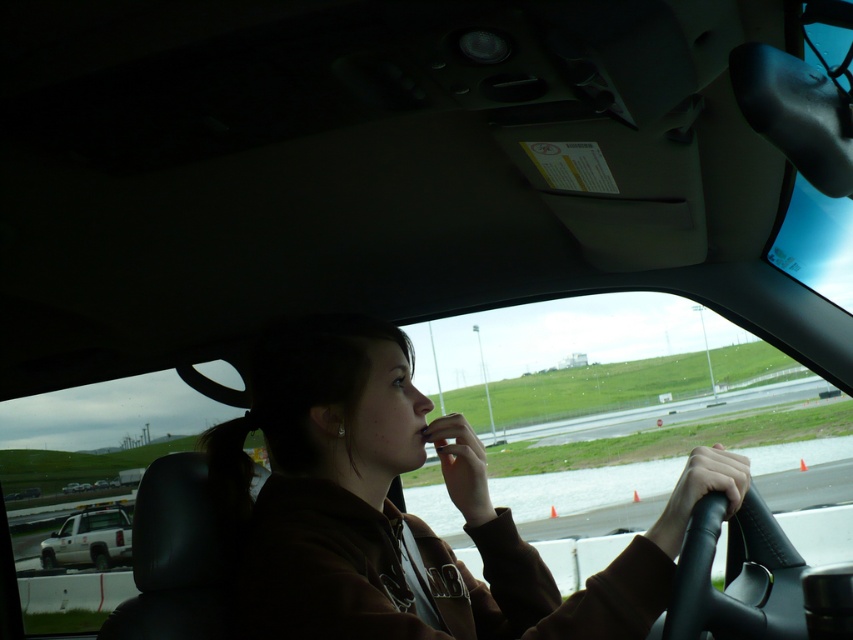
Question: Is brown cotton jacket at center positioned at the back of white matte truck at lower left?

Choices:
 (A) yes
 (B) no

Answer: (B)

Question: Can you confirm if brown cotton jacket at center is smaller than white matte truck at lower left?

Choices:
 (A) no
 (B) yes

Answer: (A)

Question: Among these objects, which one is nearest to the camera?

Choices:
 (A) brown cotton jacket at center
 (B) white matte truck at lower left

Answer: (A)

Question: Can you confirm if brown cotton jacket at center is bigger than white matte truck at lower left?

Choices:
 (A) no
 (B) yes

Answer: (B)